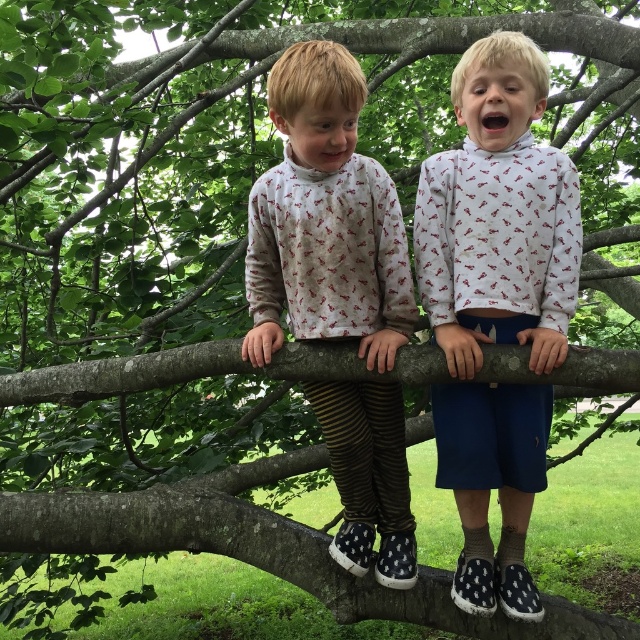
You are a parent trying to ensure your child can comfortably stand on the tree limb. Given the sizes of the striped leggings at center and the smooth bark tree limb at center, which one is bigger?

The striped leggings at center has a larger size compared to the smooth bark tree limb at center.

You are a photographer trying to capture a clear shot of the striped leggings at center and the smooth bark tree limb at center. Which object will appear closer to the camera in the photo?

The striped leggings at center will appear closer to the camera because it is in front of the smooth bark tree limb at center.